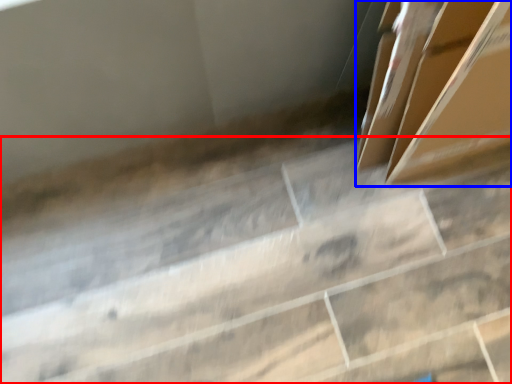
Question: Among these objects, which one is nearest to the camera, concrete (highlighted by a red box) or box (highlighted by a blue box)?

Choices:
 (A) concrete
 (B) box

Answer: (B)